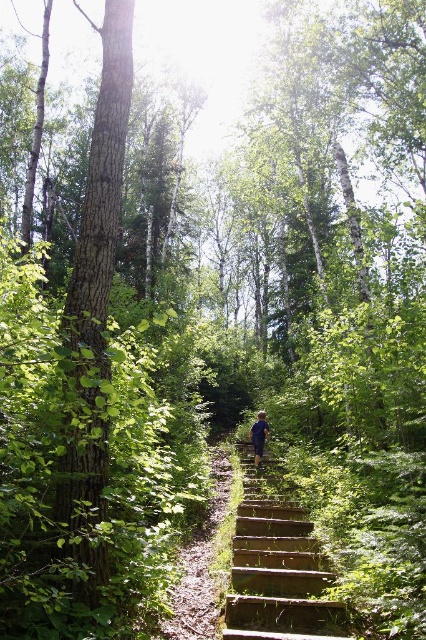
Question: Is green rough bark tree at left above blue fabric hiker at center?

Choices:
 (A) yes
 (B) no

Answer: (A)

Question: Is green rough bark tree at left wider than wooden stairs at center?

Choices:
 (A) yes
 (B) no

Answer: (A)

Question: Which of the following is the farthest from the observer?

Choices:
 (A) green rough bark tree at left
 (B) blue fabric hiker at center

Answer: (B)

Question: Which of these objects is positioned closest to the green rough bark tree at left?

Choices:
 (A) blue fabric hiker at center
 (B) wooden stairs at center

Answer: (B)

Question: Based on their relative distances, which object is nearer to the wooden stairs at center?

Choices:
 (A) green rough bark tree at left
 (B) blue fabric hiker at center

Answer: (A)

Question: Is wooden stairs at center wider than blue fabric hiker at center?

Choices:
 (A) no
 (B) yes

Answer: (B)